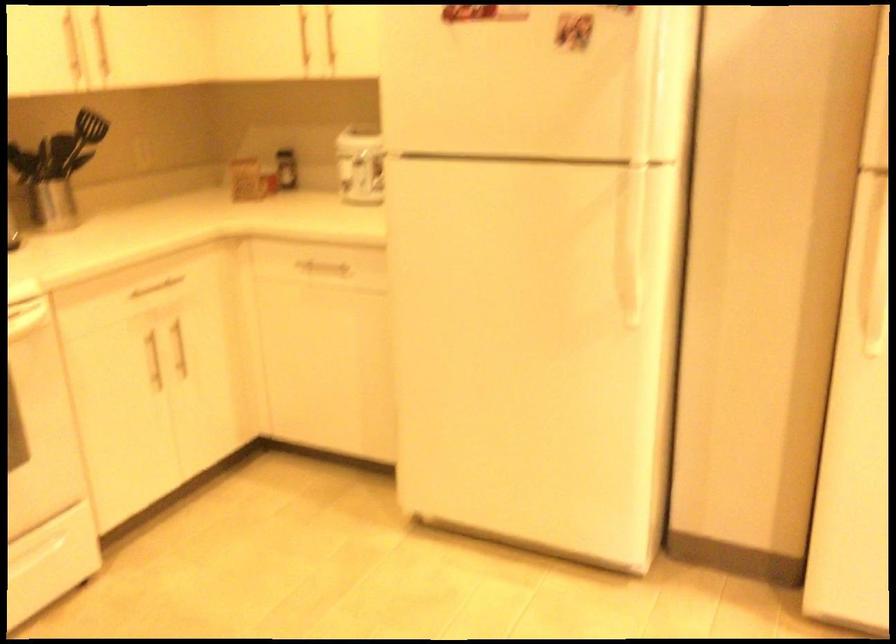
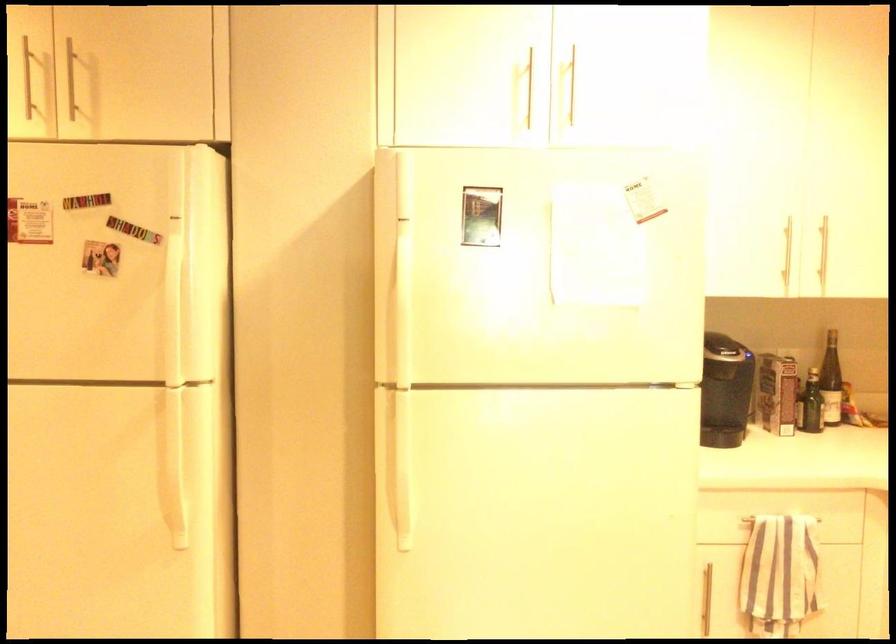
Question: The camera is either moving clockwise (left) or counter-clockwise (right) around the object. The first image is from the beginning of the video and the second image is from the end. Is the camera moving left or right when shooting the video?

Choices:
 (A) Left
 (B) Right

Answer: (A)